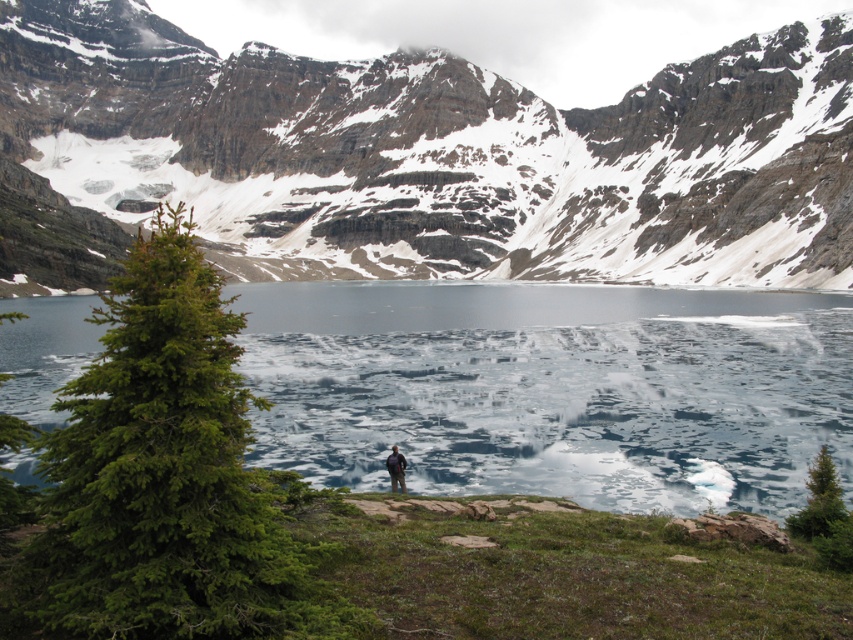
Consider the image. You are a hiker planning to cross the lake. You see the rocky gray mountain at upper center and the translucent ice at center. Which object is closer to you, and why?

The rocky gray mountain at upper center is closer to you because it is positioned further to the viewer than the translucent ice at center, meaning it appears nearer in the visual perspective.

You are a hiker who wants to cross the frozen lake. You see the translucent ice at center and the dark blue fabric at center. Which one is safer to step on?

The translucent ice at center is much taller than the dark blue fabric at center, so stepping on the translucent ice at center is safer because thicker ice is more stable.